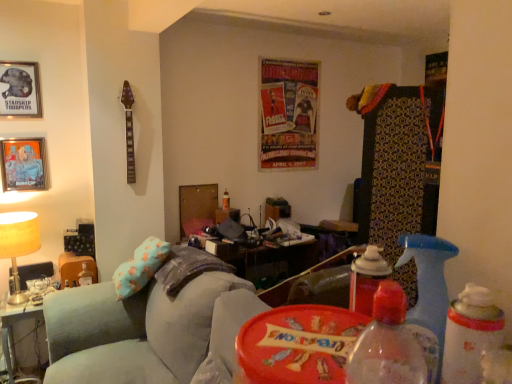
Question: Considering the positions of velvet teal swivel chair at lower left and translucent plastic spray bottle at right, the 2th bottle viewed from the front, in the image, is velvet teal swivel chair at lower left bigger or smaller than translucent plastic spray bottle at right, the 2th bottle viewed from the front,?

Choices:
 (A) big
 (B) small

Answer: (A)

Question: Is velvet teal swivel chair at lower left wider or thinner than translucent plastic spray bottle at right, the third bottle from the back?

Choices:
 (A) thin
 (B) wide

Answer: (B)

Question: Based on their relative distances, which object is farther from the white plastic table at lower left?

Choices:
 (A) shiny paper poster at center
 (B) translucent plastic bottle at lower right, the first bottle when ordered from front to back
 (C) metallic silver picture frame at upper left, which appears as the second picture frame when ordered from the bottom
 (D) velvet teal swivel chair at lower left
 (E) matte gold table lamp at left

Answer: (B)

Question: Which object is the farthest from the velvet teal swivel chair at lower left?

Choices:
 (A) shiny paper poster at center
 (B) translucent plastic bottle at lower left, which is counted as the fourth bottle, starting from the right
 (C) translucent plastic spray bottle at right, which appears as the first bottle when viewed from the right
 (D) metallic silver picture frame at upper left, which appears as the second picture frame when ordered from the bottom
 (E) translucent plastic bottle at lower right, the second bottle viewed from the right

Answer: (C)